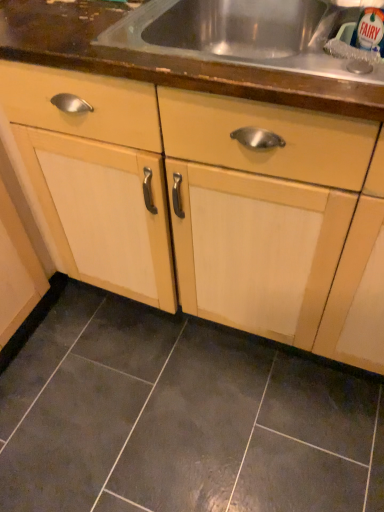
Question: Should I look upward or downward to see dark gray ceramic tile at lower center?

Choices:
 (A) up
 (B) down

Answer: (B)

Question: From a real-world perspective, is wooden countertop at upper center below dark gray ceramic tile at lower center?

Choices:
 (A) yes
 (B) no

Answer: (B)

Question: Is wooden countertop at upper center beside dark gray ceramic tile at lower center?

Choices:
 (A) yes
 (B) no

Answer: (B)

Question: Is wooden countertop at upper center further to camera compared to dark gray ceramic tile at lower center?

Choices:
 (A) no
 (B) yes

Answer: (A)

Question: Considering the relative sizes of wooden countertop at upper center and dark gray ceramic tile at lower center in the image provided, is wooden countertop at upper center taller than dark gray ceramic tile at lower center?

Choices:
 (A) yes
 (B) no

Answer: (A)

Question: Is wooden countertop at upper center far from dark gray ceramic tile at lower center?

Choices:
 (A) no
 (B) yes

Answer: (A)

Question: Is wooden countertop at upper center thinner than dark gray ceramic tile at lower center?

Choices:
 (A) no
 (B) yes

Answer: (B)

Question: Considering the relative sizes of wooden countertop at upper center and light wood cabinet at center in the image provided, is wooden countertop at upper center wider than light wood cabinet at center?

Choices:
 (A) yes
 (B) no

Answer: (B)

Question: Is wooden countertop at upper center positioned beyond the bounds of light wood cabinet at center?

Choices:
 (A) yes
 (B) no

Answer: (B)

Question: From a real-world perspective, is wooden countertop at upper center below light wood cabinet at center?

Choices:
 (A) yes
 (B) no

Answer: (B)

Question: Does wooden countertop at upper center have a larger size compared to light wood cabinet at center?

Choices:
 (A) yes
 (B) no

Answer: (B)

Question: Does wooden countertop at upper center come in front of light wood cabinet at center?

Choices:
 (A) no
 (B) yes

Answer: (A)

Question: Considering the relative positions of wooden countertop at upper center and light wood cabinet at center in the image provided, is wooden countertop at upper center to the left of light wood cabinet at center from the viewer's perspective?

Choices:
 (A) no
 (B) yes

Answer: (A)

Question: Are dark gray ceramic tile at lower center and wooden countertop at upper center far apart?

Choices:
 (A) no
 (B) yes

Answer: (A)